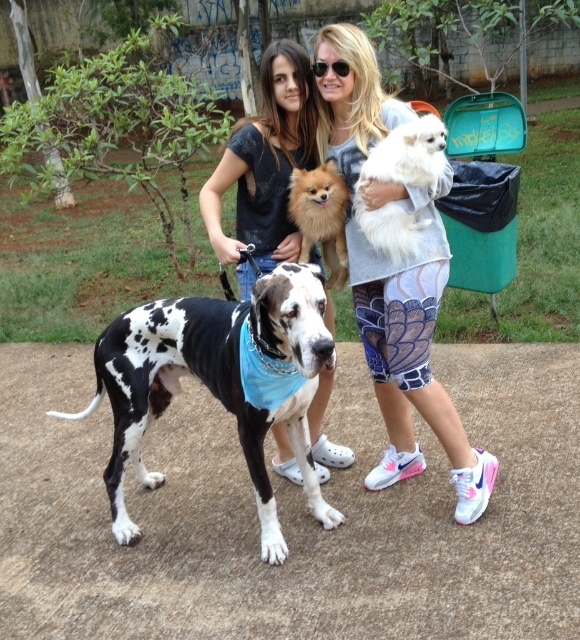
Question: Which object is farther from the camera taking this photo?

Choices:
 (A) black and white spotted dog at center
 (B) matte black shirt at center
 (C) white printed leggings at center
 (D) fuzzy brown dog at center

Answer: (D)

Question: Can you confirm if white printed leggings at center is positioned to the left of fuzzy brown dog at center?

Choices:
 (A) yes
 (B) no

Answer: (B)

Question: Which point is farther to the camera?

Choices:
 (A) white fluffy dog at center
 (B) fuzzy brown dog at center

Answer: (B)

Question: Estimate the real-world distances between objects in this image. Which object is farther from the fuzzy brown dog at center?

Choices:
 (A) matte black shirt at center
 (B) white fluffy dog at center

Answer: (B)

Question: Is the position of black and white spotted dog at center less distant than that of fuzzy brown dog at center?

Choices:
 (A) yes
 (B) no

Answer: (A)

Question: From the image, what is the correct spatial relationship of matte black shirt at center in relation to fuzzy brown dog at center?

Choices:
 (A) below
 (B) above

Answer: (B)